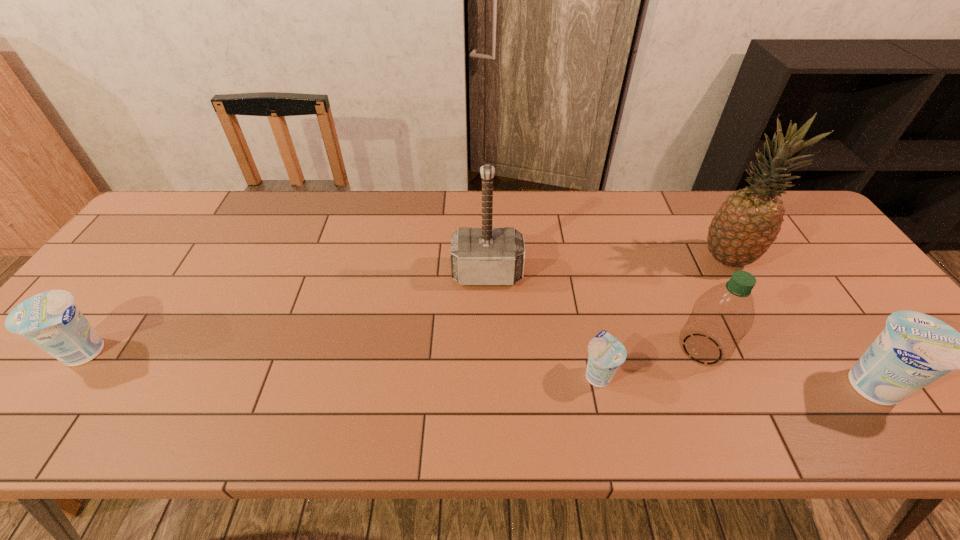
Image resolution: width=960 pixels, height=540 pixels. Identify the location of object situated at the near right corner. (914, 349).

The width and height of the screenshot is (960, 540). In the image, there is a desktop. What are the coordinates of `free space at the far edge` in the screenshot? It's located at (591, 207).

The height and width of the screenshot is (540, 960). What are the coordinates of `free spot at the near edge of the desktop` in the screenshot? It's located at (277, 386).

Image resolution: width=960 pixels, height=540 pixels. Identify the location of blank space at the left edge of the desktop. (138, 260).

Where is `vacant position at the right edge of the desktop`? This screenshot has width=960, height=540. vacant position at the right edge of the desktop is located at coordinates (860, 284).

Image resolution: width=960 pixels, height=540 pixels. What are the coordinates of `vacant space in between the fourth shortest object and the second yogurt from left to right` in the screenshot? It's located at (650, 361).

At what (x,y) coordinates should I click in order to perform the action: click on free space between the leftmost object and the rightmost yogurt. Please return your answer as a coordinate pair (x, y). Looking at the image, I should click on (478, 369).

Locate an element on the screen. The width and height of the screenshot is (960, 540). empty space between the pineapple and the second object from left to right is located at coordinates pyautogui.click(x=607, y=266).

The image size is (960, 540). Identify the location of vacant area that lies between the second yogurt from right to left and the tallest object. (662, 316).

Locate an element on the screen. free space between the leftmost yogurt and the second object from left to right is located at coordinates (287, 313).